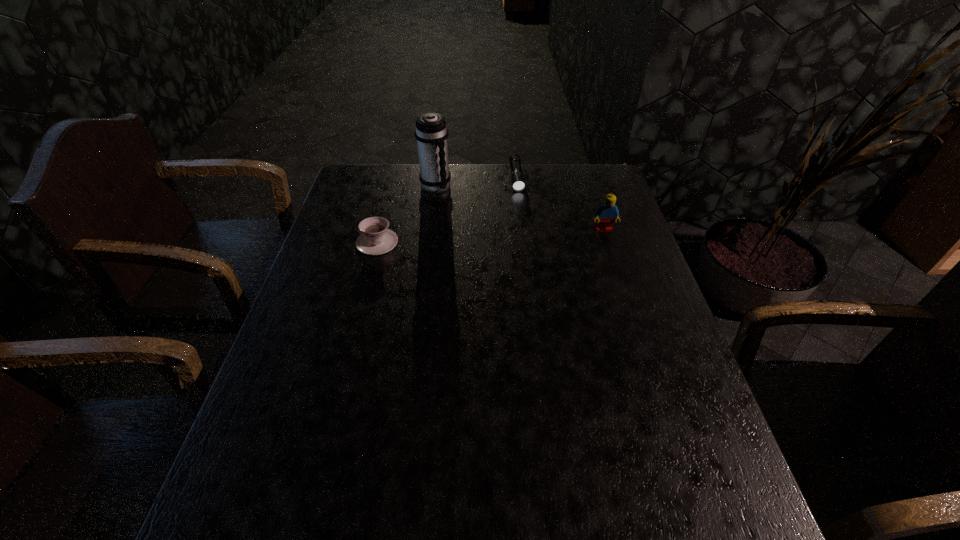
Identify the location of empty space that is in between the Lego and the leftmost object. This screenshot has width=960, height=540. (491, 236).

Identify the location of vacant area between the tallest object and the third tallest object. (406, 215).

Where is `vacant space that is in between the thermos bottle and the third shortest object`? vacant space that is in between the thermos bottle and the third shortest object is located at coordinates (519, 208).

This screenshot has height=540, width=960. Find the location of `vacant space in between the rightmost object and the flashlight`. vacant space in between the rightmost object and the flashlight is located at coordinates (561, 204).

I want to click on vacant area that lies between the Lego and the thermos bottle, so click(519, 208).

This screenshot has height=540, width=960. I want to click on free space between the teacup and the third shortest object, so click(491, 236).

Identify which object is the nearest to the thermos bottle. Please provide its 2D coordinates. Your answer should be formatted as a tuple, i.e. [(x, y)], where the tuple contains the x and y coordinates of a point satisfying the conditions above.

[(376, 239)]

This screenshot has height=540, width=960. Identify the location of object that can be found as the closest to the Lego. (517, 178).